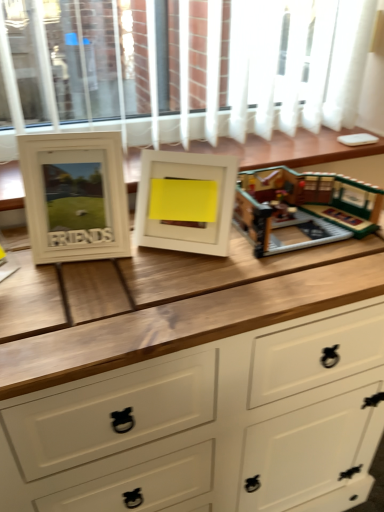
Identify the location of free point below brick-like lego set at center (from a real-world perspective). (304, 229).